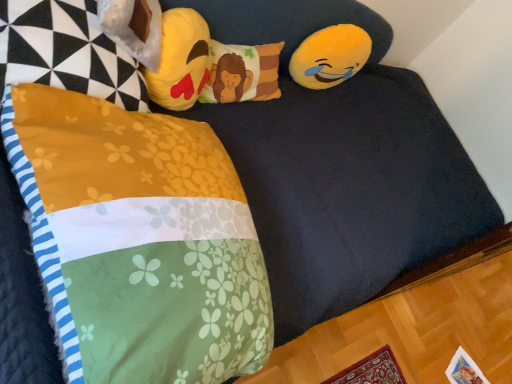
Question: From a real-world perspective, is floral fabric pillow at center, the 2th pillow ordered from the bottom, above or below fluffy floral blanket at lower left, which is counted as the 1th pillow, starting from the bottom?

Choices:
 (A) above
 (B) below

Answer: (B)

Question: Does point (200, 97) appear closer or farther from the camera than point (223, 342)?

Choices:
 (A) closer
 (B) farther

Answer: (B)

Question: Which object is the farthest from the yellow plush emoji at upper right, the first toy positioned from the right?

Choices:
 (A) soft yellow plush emoji at upper center, the first toy positioned from the front
 (B) fluffy floral blanket at lower left, the 1th pillow when ordered from front to back
 (C) floral fabric pillow at center, arranged as the first pillow when viewed from the back

Answer: (B)

Question: Which is farther from the yellow plush emoji at upper right, which is the 2th toy in front-to-back order?

Choices:
 (A) soft yellow plush emoji at upper center, the second toy when ordered from back to front
 (B) floral fabric pillow at center, arranged as the first pillow when viewed from the back
 (C) fluffy floral blanket at lower left, which is counted as the 1th pillow, starting from the bottom

Answer: (C)